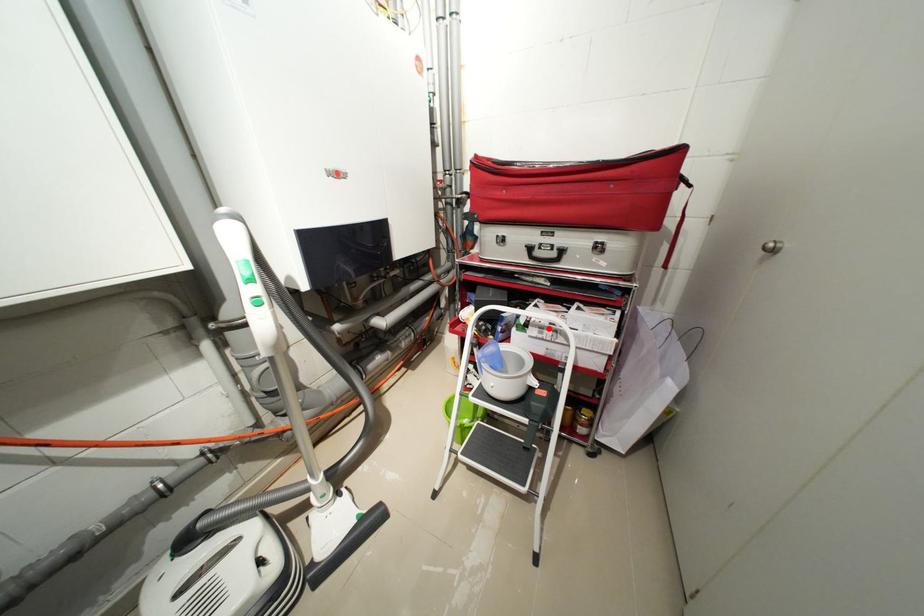
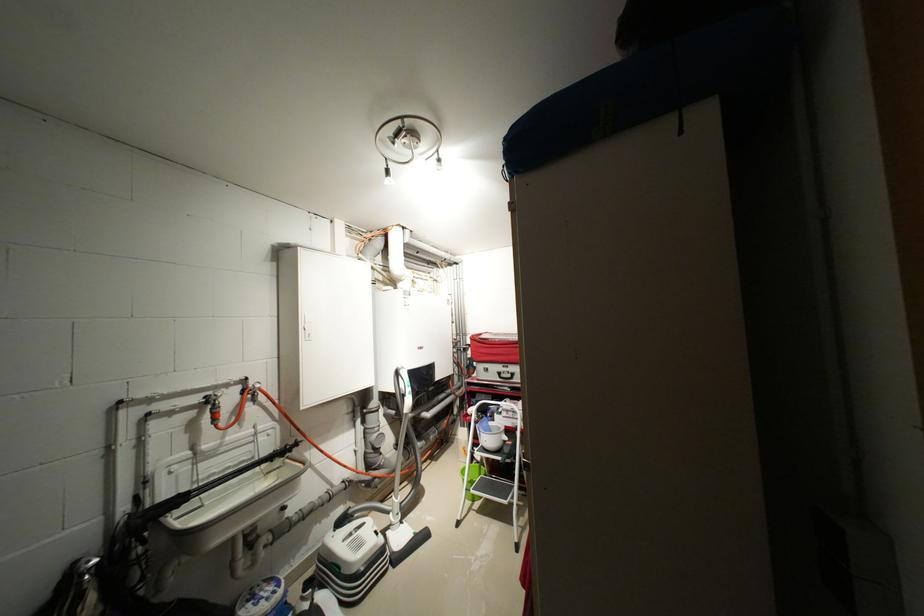
Where in the second image is the point corresponding to the highlighted location from the first image?

(515, 411)